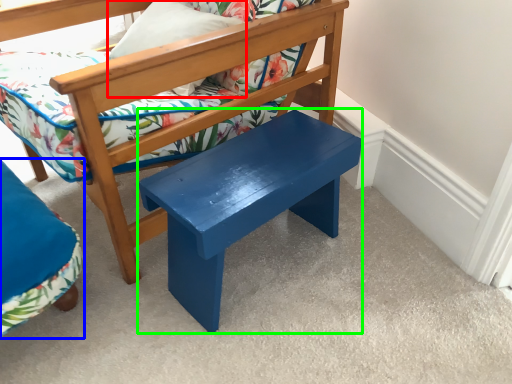
Question: Estimate the real-world distances between objects in this image. Which object is closer to pillow (highlighted by a red box), chair (highlighted by a blue box) or stool (highlighted by a green box)?

Choices:
 (A) chair
 (B) stool

Answer: (B)